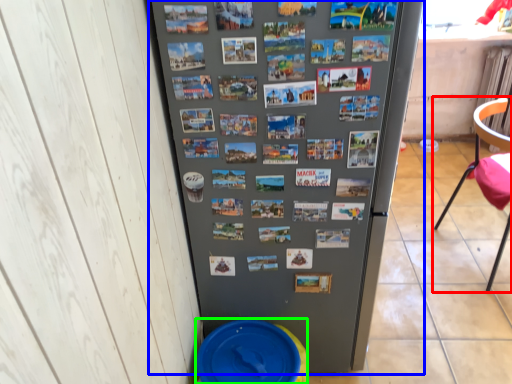
Question: Which is farther away from chair (highlighted by a red box)? refrigerator (highlighted by a blue box) or potty (highlighted by a green box)?

Choices:
 (A) refrigerator
 (B) potty

Answer: (B)